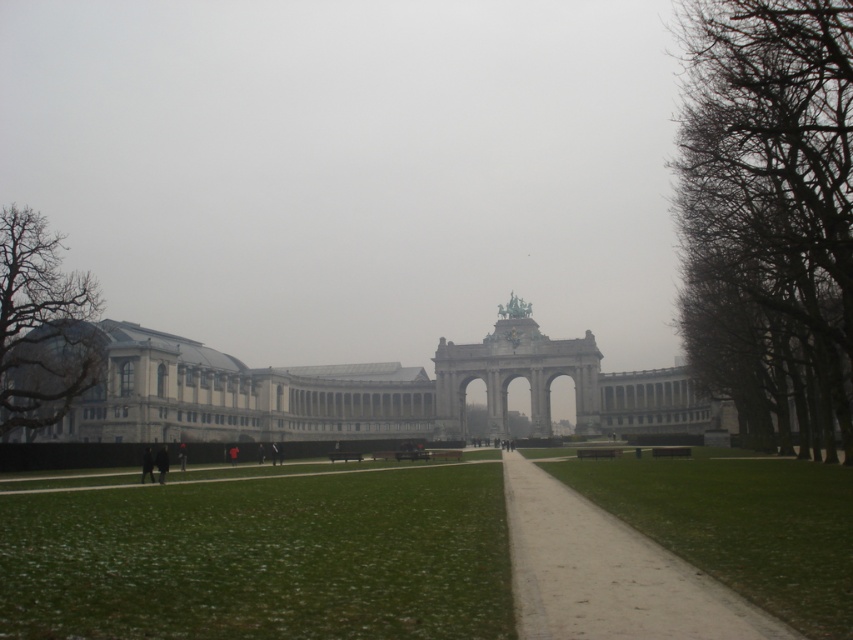
Question: Is green grass at lower center behind dark gray coat at lower left?

Choices:
 (A) yes
 (B) no

Answer: (B)

Question: Which point is closer to the camera?

Choices:
 (A) (184, 364)
 (B) (178, 451)
 (C) (143, 481)

Answer: (C)

Question: Which point appears closest to the camera in this image?

Choices:
 (A) (24, 396)
 (B) (154, 477)
 (C) (184, 456)
 (D) (160, 451)

Answer: (B)

Question: Estimate the real-world distances between objects in this image. Which object is farther from the matte glass palace at left?

Choices:
 (A) bare branches at right
 (B) smooth concrete path at center

Answer: (A)

Question: Does gray stone palace at center appear under dark gray jacket at lower left?

Choices:
 (A) no
 (B) yes

Answer: (A)

Question: Is green grass at lower center thinner than smooth concrete path at center?

Choices:
 (A) no
 (B) yes

Answer: (A)